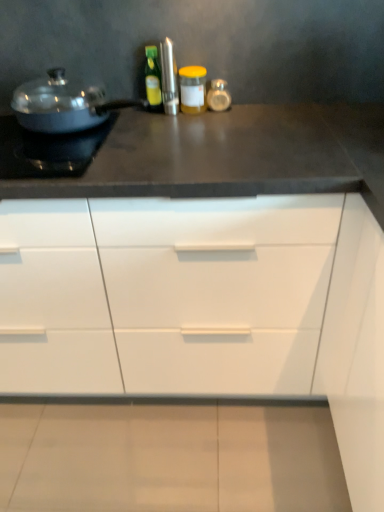
You are a GUI agent. You are given a task and a screenshot of the screen. Output one action in this format:
    pyautogui.click(x=<x>, y=<y>)
    Task: Click on the free point below shiny metallic pot at left (from a real-world perspective)
    The image size is (384, 512).
    Given the screenshot: What is the action you would take?
    pyautogui.click(x=106, y=126)